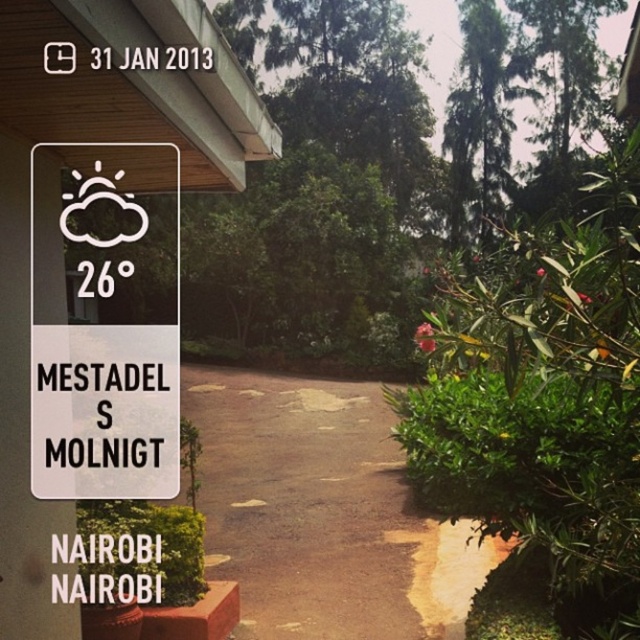
You are standing at the point marked by the coordinates point (323,513) on the brown asphalt path at center. You want to walk straight ahead. Based on the scene description, what will you encounter first?

The brown asphalt path at center continues towards the building partially visible on the left side of the frame, so walking straight ahead from point (323,513) on the brown asphalt path at center, you will first encounter the building partially visible on the left side of the frame.

You are a visitor at a botanical garden and want to find the main entrance. You see the brown asphalt path at center and the white plastic sign at upper left. According to the scene, which object is positioned higher up in the image?

The white plastic sign at upper left is positioned higher up in the image than the brown asphalt path at center.